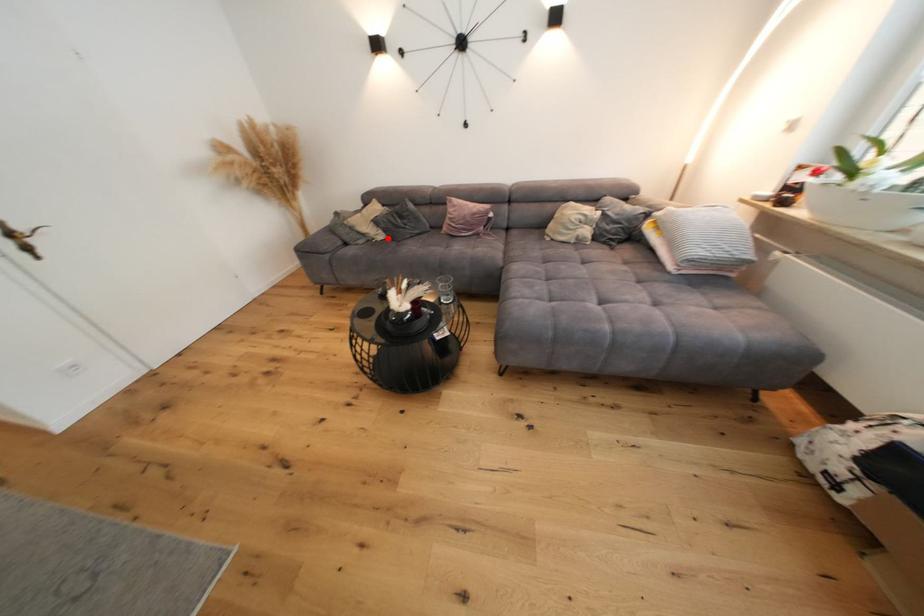
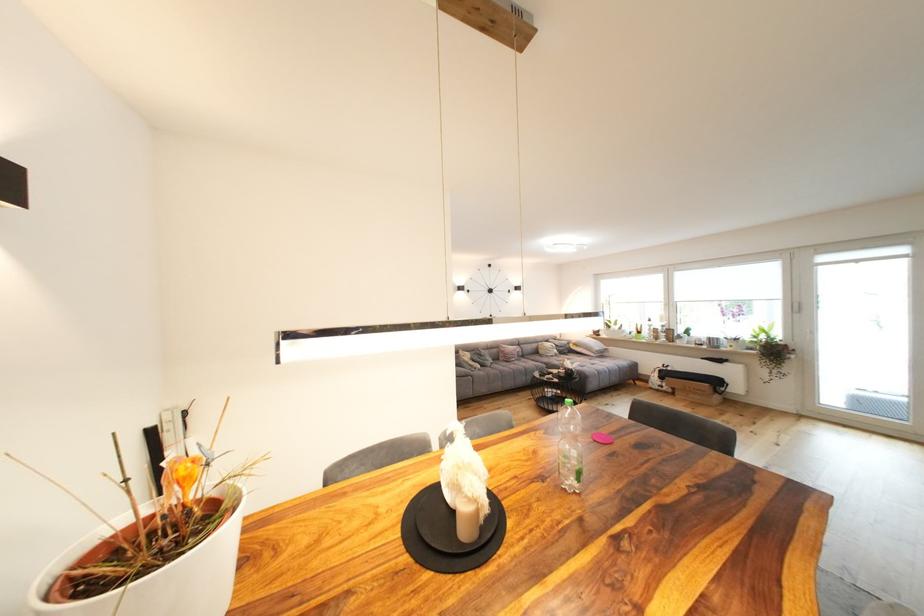
In the second image, find the point that corresponds to the highlighted location in the first image.

(485, 368)